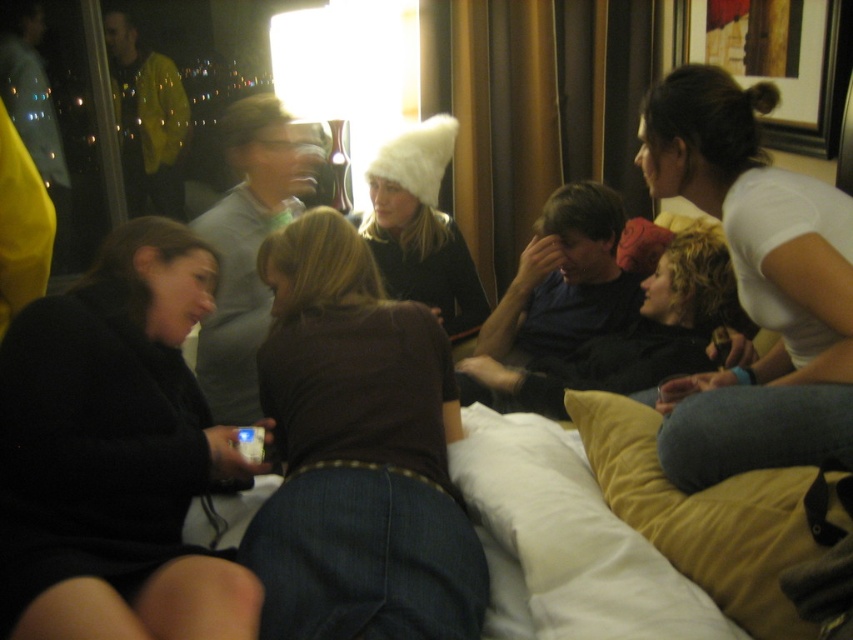
You are a photographer standing at the camera position. You want to take a closeup photo of the black matte jacket at lower left without moving the camera. Is the jacket within the camera focus range of 35 inches? Please explain your answer.

The black matte jacket at lower left is 37.46 inches away from the camera. Since the focus range is 35 inches, the jacket is slightly out of the focus range and may not be in clear focus unless the camera adjusts its settings.

You are organizing a small event in the hotel room and need to decide whether the brown fabric shirt at center can be placed on the white soft pillow at lower center. Based on their sizes, will the shirt fit on the pillow?

The brown fabric shirt at center is wider than the white soft pillow at lower center, so the shirt may not fit entirely on the pillow due to its greater width.